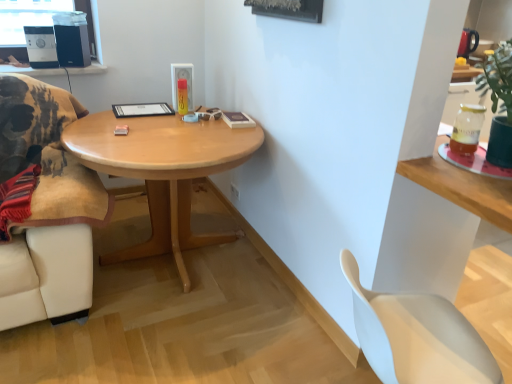
Question: Looking at the image, does translucent glass jar at upper right seem bigger or smaller compared to black matte speaker at upper left, which is the first speaker from right to left?

Choices:
 (A) small
 (B) big

Answer: (A)

Question: Is translucent glass jar at upper right to the left or to the right of black matte speaker at upper left, positioned as the 2th speaker in left-to-right order, in the image?

Choices:
 (A) right
 (B) left

Answer: (A)

Question: Based on their relative distances, which object is farther from the light wood/finish coffee table at center?

Choices:
 (A) matte black speaker at upper left, the second speaker in the right-to-left sequence
 (B) translucent glass jar at upper right
 (C) white plastic chair at lower right
 (D) black matte speaker at upper left, which is the first speaker from right to left

Answer: (B)

Question: Which is nearer to the translucent glass jar at upper right?

Choices:
 (A) white plastic chair at lower right
 (B) light wood/finish coffee table at center
 (C) matte black speaker at upper left, the second speaker in the right-to-left sequence
 (D) black matte speaker at upper left, which is the first speaker from right to left

Answer: (A)